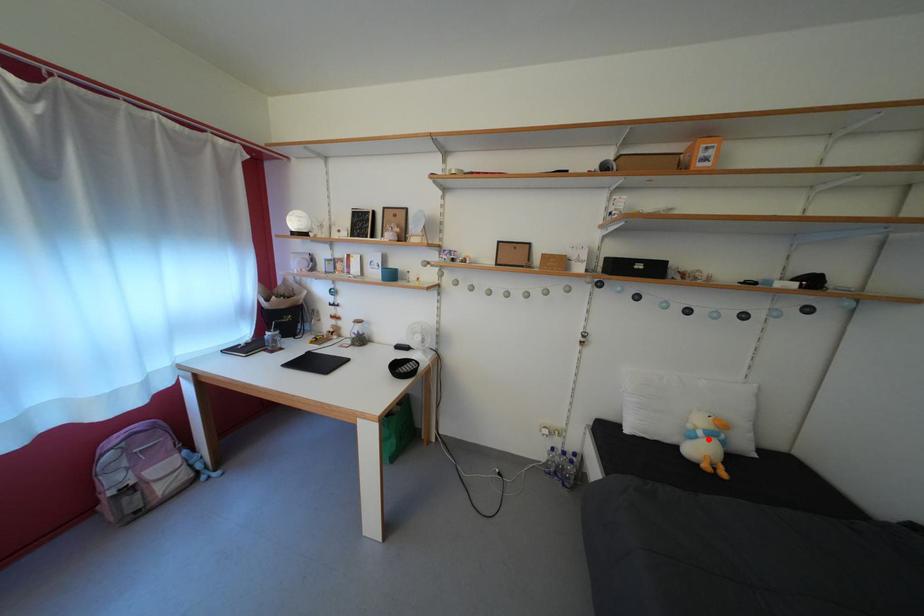
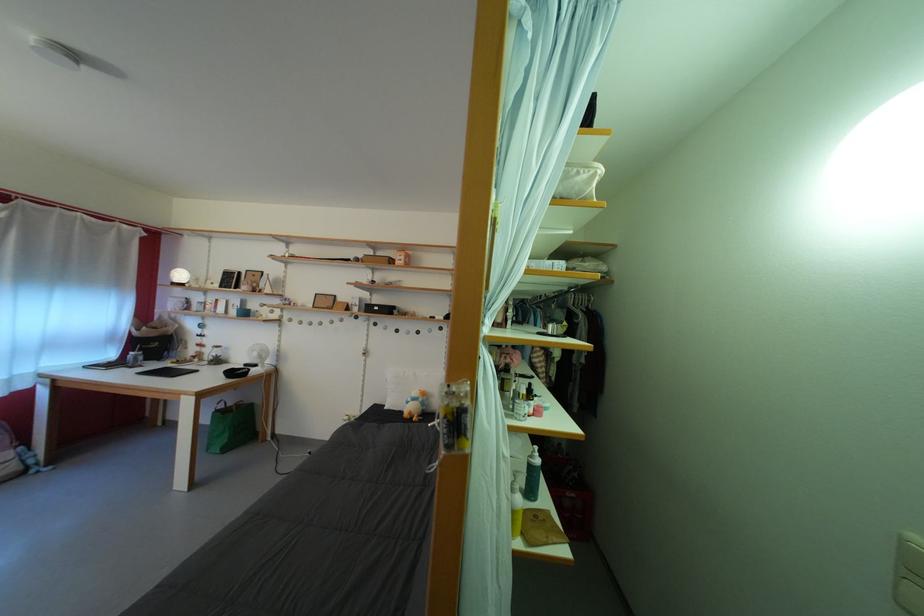
Where in the second image is the point corresponding to the highlighted location from the first image?

(418, 405)